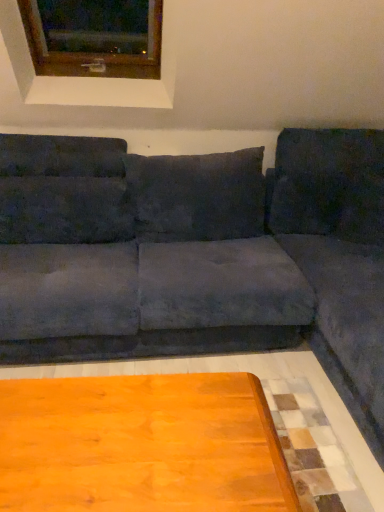
Locate an element on the screen. free space above wooden table at lower center (from a real-world perspective) is located at coordinates (x=118, y=434).